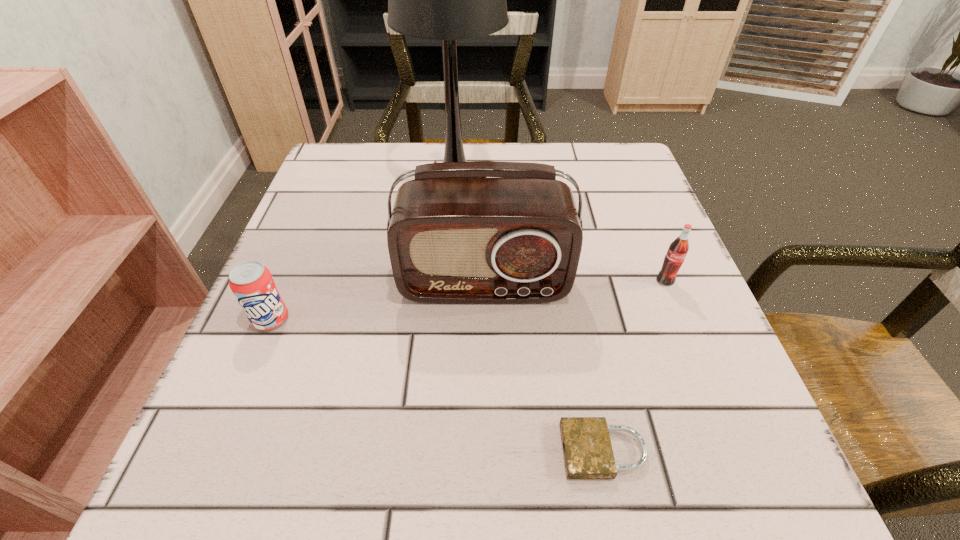
Image resolution: width=960 pixels, height=540 pixels. Find the location of `the tallest object`. the tallest object is located at coordinates (448, 0).

Where is `the farthest object`? the farthest object is located at coordinates (448, 0).

At what (x,y) coordinates should I click in order to perform the action: click on the fourth shortest object. Please return your answer as a coordinate pair (x, y). The image size is (960, 540). Looking at the image, I should click on (452, 239).

You are a GUI agent. You are given a task and a screenshot of the screen. Output one action in this format:
    pyautogui.click(x=<x>, y=<y>)
    Task: Click on the farther soda can
    Image resolution: width=960 pixels, height=540 pixels.
    Given the screenshot: What is the action you would take?
    [x=678, y=249]

The image size is (960, 540). I want to click on the rightmost object, so click(678, 249).

This screenshot has height=540, width=960. I want to click on the shorter soda can, so click(252, 284).

You are a GUI agent. You are given a task and a screenshot of the screen. Output one action in this format:
    pyautogui.click(x=<x>, y=<y>)
    Task: Click on the second shortest object
    
    Given the screenshot: What is the action you would take?
    pyautogui.click(x=252, y=284)

Locate an element on the screen. The image size is (960, 540). padlock is located at coordinates (588, 454).

Locate an element on the screen. The image size is (960, 540). the nearest object is located at coordinates (588, 454).

This screenshot has height=540, width=960. I want to click on blank space located 0.290m on the right of the tallest object, so click(630, 184).